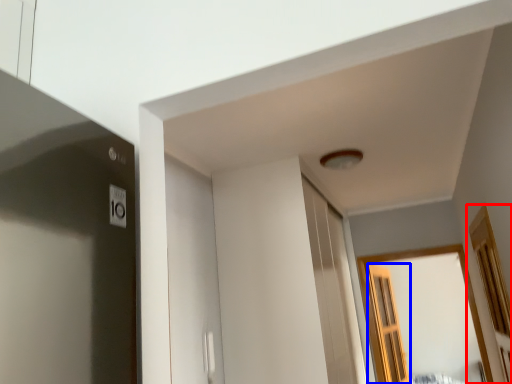
Question: Among these objects, which one is nearest to the camera, window (highlighted by a red box) or screen door (highlighted by a blue box)?

Choices:
 (A) window
 (B) screen door

Answer: (A)